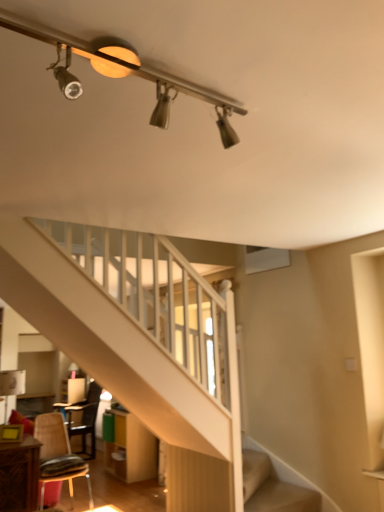
I want to click on metallic track lighting at upper center, so click(124, 73).

What do you see at coordinates (131, 449) in the screenshot? This screenshot has width=384, height=512. I see `wooden dresser at lower center` at bounding box center [131, 449].

Identify the location of metallic brown chair at lower left, which is counted as the 2th chair, starting from the back. Image resolution: width=384 pixels, height=512 pixels. (58, 455).

Which of these two, metallic track lighting at upper center or wooden chair at lower left, the 1th chair when ordered from back to front, is smaller?

With smaller size is metallic track lighting at upper center.

Is metallic track lighting at upper center facing away from wooden chair at lower left, marked as the second chair in a front-to-back arrangement?

That's not correct — metallic track lighting at upper center is not looking away from wooden chair at lower left, marked as the second chair in a front-to-back arrangement.

Does metallic track lighting at upper center appear on the left side of wooden chair at lower left, marked as the second chair in a front-to-back arrangement?

No.

Is wooden chair at lower left, the 1th chair when ordered from back to front, looking in the opposite direction of metallic brown chair at lower left, which is counted as the 2th chair, starting from the back?

wooden chair at lower left, the 1th chair when ordered from back to front, does not have its back to metallic brown chair at lower left, which is counted as the 2th chair, starting from the back.

Based on the photo, is metallic brown chair at lower left, which is counted as the 2th chair, starting from the back, completely or partially inside wooden chair at lower left, the 1th chair when ordered from back to front?

No, metallic brown chair at lower left, which is counted as the 2th chair, starting from the back, is located outside of wooden chair at lower left, the 1th chair when ordered from back to front.

Which point is more forward, (95, 417) or (60, 418)?

The point (60, 418) is in front.

Which object is thinner, wooden chair at lower left, marked as the second chair in a front-to-back arrangement, or metallic brown chair at lower left, which appears as the 1th chair when viewed from the front?

With smaller width is metallic brown chair at lower left, which appears as the 1th chair when viewed from the front.

Considering the positions of objects wooden dresser at lower center and wooden chair at lower left, the 1th chair when ordered from back to front, in the image provided, who is behind, wooden dresser at lower center or wooden chair at lower left, the 1th chair when ordered from back to front,?

Positioned behind is wooden chair at lower left, the 1th chair when ordered from back to front.

Is point (153, 466) positioned in front of point (80, 430)?

Yes, it is in front of point (80, 430).

Considering the relative sizes of wooden dresser at lower center and wooden chair at lower left, the 1th chair when ordered from back to front, in the image provided, is wooden dresser at lower center bigger than wooden chair at lower left, the 1th chair when ordered from back to front,?

Actually, wooden dresser at lower center might be smaller than wooden chair at lower left, the 1th chair when ordered from back to front.

Do you think wooden dresser at lower center is within wooden chair at lower left, marked as the second chair in a front-to-back arrangement, or outside of it?

wooden dresser at lower center is not inside wooden chair at lower left, marked as the second chair in a front-to-back arrangement, it's outside.

Based on their positions, is wooden chair at lower left, marked as the second chair in a front-to-back arrangement, located to the left or right of wooden dresser at lower center?

wooden chair at lower left, marked as the second chair in a front-to-back arrangement, is positioned on wooden dresser at lower center's left side.

From a real-world perspective, is wooden chair at lower left, marked as the second chair in a front-to-back arrangement, physically below wooden dresser at lower center?

No, from a real-world perspective, wooden chair at lower left, marked as the second chair in a front-to-back arrangement, is not below wooden dresser at lower center.

Considering the sizes of objects wooden chair at lower left, marked as the second chair in a front-to-back arrangement, and wooden dresser at lower center in the image provided, who is shorter, wooden chair at lower left, marked as the second chair in a front-to-back arrangement, or wooden dresser at lower center?

Standing shorter between the two is wooden dresser at lower center.

From a real-world perspective, between metallic brown chair at lower left, which appears as the 1th chair when viewed from the front, and wooden dresser at lower center, who is vertically lower?

wooden dresser at lower center, from a real-world perspective.

What's the angular difference between metallic brown chair at lower left, which is counted as the 2th chair, starting from the back, and wooden dresser at lower center's facing directions?

The facing directions of metallic brown chair at lower left, which is counted as the 2th chair, starting from the back, and wooden dresser at lower center are 88.4 degrees apart.

Which is correct: metallic brown chair at lower left, which is counted as the 2th chair, starting from the back, is inside wooden dresser at lower center, or outside of it?

metallic brown chair at lower left, which is counted as the 2th chair, starting from the back, exists outside the volume of wooden dresser at lower center.

Considering the positions of objects metallic track lighting at upper center and wooden dresser at lower center in the image provided, who is more to the right, metallic track lighting at upper center or wooden dresser at lower center?

metallic track lighting at upper center is more to the right.

Can you see metallic track lighting at upper center touching wooden dresser at lower center?

No, metallic track lighting at upper center is not with wooden dresser at lower center.

Do you think metallic track lighting at upper center is within wooden dresser at lower center, or outside of it?

metallic track lighting at upper center is located beyond the bounds of wooden dresser at lower center.

Does metallic track lighting at upper center lie behind wooden dresser at lower center?

No, the depth of metallic track lighting at upper center is less than that of wooden dresser at lower center.

From a real-world perspective, which is physically above, metallic brown chair at lower left, which is counted as the 2th chair, starting from the back, or metallic track lighting at upper center?

metallic track lighting at upper center.

From the image's perspective, does metallic brown chair at lower left, which appears as the 1th chair when viewed from the front, appear higher than metallic track lighting at upper center?

No, from the image's perspective, metallic brown chair at lower left, which appears as the 1th chair when viewed from the front, is not on top of metallic track lighting at upper center.

Considering the positions of point (57, 453) and point (22, 31), is point (57, 453) closer or farther from the camera than point (22, 31)?

Point (57, 453) is farther from the camera than point (22, 31).

From the metallic track lighting at upper center, count the 2nd chair to the left and point to it. Please provide its 2D coordinates.

[(85, 418)]

At what (x,y) coordinates should I click in order to perform the action: click on chair in front of the wooden chair at lower left, the 1th chair when ordered from back to front. Please return your answer as a coordinate pair (x, y). The height and width of the screenshot is (512, 384). Looking at the image, I should click on (58, 455).

Considering their positions, is metallic brown chair at lower left, which is counted as the 2th chair, starting from the back, positioned closer to wooden dresser at lower center than wooden chair at lower left, marked as the second chair in a front-to-back arrangement?

wooden chair at lower left, marked as the second chair in a front-to-back arrangement, is positioned closer to the anchor wooden dresser at lower center.

When comparing their distances from wooden chair at lower left, marked as the second chair in a front-to-back arrangement, does metallic brown chair at lower left, which is counted as the 2th chair, starting from the back, or metallic track lighting at upper center seem further?

metallic track lighting at upper center.

Which object lies nearer to the anchor point wooden dresser at lower center, wooden chair at lower left, the 1th chair when ordered from back to front, or metallic brown chair at lower left, which is counted as the 2th chair, starting from the back?

wooden chair at lower left, the 1th chair when ordered from back to front, is closer to wooden dresser at lower center.

Looking at the image, which one is located further to wooden chair at lower left, the 1th chair when ordered from back to front, metallic brown chair at lower left, which appears as the 1th chair when viewed from the front, or wooden dresser at lower center?

metallic brown chair at lower left, which appears as the 1th chair when viewed from the front, lies further to wooden chair at lower left, the 1th chair when ordered from back to front, than the other object.

Considering their positions, is metallic track lighting at upper center positioned closer to metallic brown chair at lower left, which appears as the 1th chair when viewed from the front, than wooden chair at lower left, marked as the second chair in a front-to-back arrangement?

Based on the image, wooden chair at lower left, marked as the second chair in a front-to-back arrangement, appears to be nearer to metallic brown chair at lower left, which appears as the 1th chair when viewed from the front.

Looking at the image, which one is located closer to metallic brown chair at lower left, which appears as the 1th chair when viewed from the front, metallic track lighting at upper center or wooden dresser at lower center?

Among the two, wooden dresser at lower center is located nearer to metallic brown chair at lower left, which appears as the 1th chair when viewed from the front.

Considering their positions, is wooden dresser at lower center positioned further to wooden chair at lower left, marked as the second chair in a front-to-back arrangement, than metallic track lighting at upper center?

Based on the image, metallic track lighting at upper center appears to be further to wooden chair at lower left, marked as the second chair in a front-to-back arrangement.

Considering their positions, is wooden dresser at lower center positioned further to wooden chair at lower left, marked as the second chair in a front-to-back arrangement, than metallic brown chair at lower left, which appears as the 1th chair when viewed from the front?

metallic brown chair at lower left, which appears as the 1th chair when viewed from the front, is further to wooden chair at lower left, marked as the second chair in a front-to-back arrangement.

This screenshot has width=384, height=512. Identify the location of chair between metallic track lighting at upper center and wooden dresser at lower center along the z-axis. (58, 455).

Identify the location of dresser between metallic track lighting at upper center and wooden chair at lower left, marked as the second chair in a front-to-back arrangement, in the front-back direction. (131, 449).

In order to click on chair between metallic track lighting at upper center and wooden chair at lower left, the 1th chair when ordered from back to front, in the front-back direction in this screenshot , I will do (58, 455).

Image resolution: width=384 pixels, height=512 pixels. Find the location of `dresser between metallic brown chair at lower left, which is counted as the 2th chair, starting from the back, and wooden chair at lower left, the 1th chair when ordered from back to front, from front to back`. dresser between metallic brown chair at lower left, which is counted as the 2th chair, starting from the back, and wooden chair at lower left, the 1th chair when ordered from back to front, from front to back is located at coordinates (131, 449).